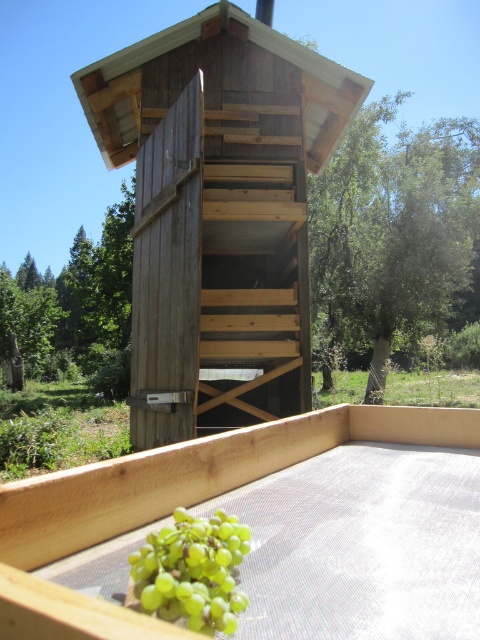
Question: Which object is farther from the camera taking this photo?

Choices:
 (A) wooden hut at center
 (B) green matte grapes at lower center

Answer: (A)

Question: Is wooden hut at center to the right of green matte grapes at lower center from the viewer's perspective?

Choices:
 (A) yes
 (B) no

Answer: (B)

Question: Is wooden hut at center smaller than green matte grapes at lower center?

Choices:
 (A) yes
 (B) no

Answer: (B)

Question: Does wooden hut at center appear on the left side of green matte grapes at lower center?

Choices:
 (A) yes
 (B) no

Answer: (A)

Question: Among these objects, which one is farthest from the camera?

Choices:
 (A) green matte grapes at lower center
 (B) wooden hut at center

Answer: (B)

Question: Which of the following is the farthest from the observer?

Choices:
 (A) (197, 208)
 (B) (180, 557)

Answer: (A)